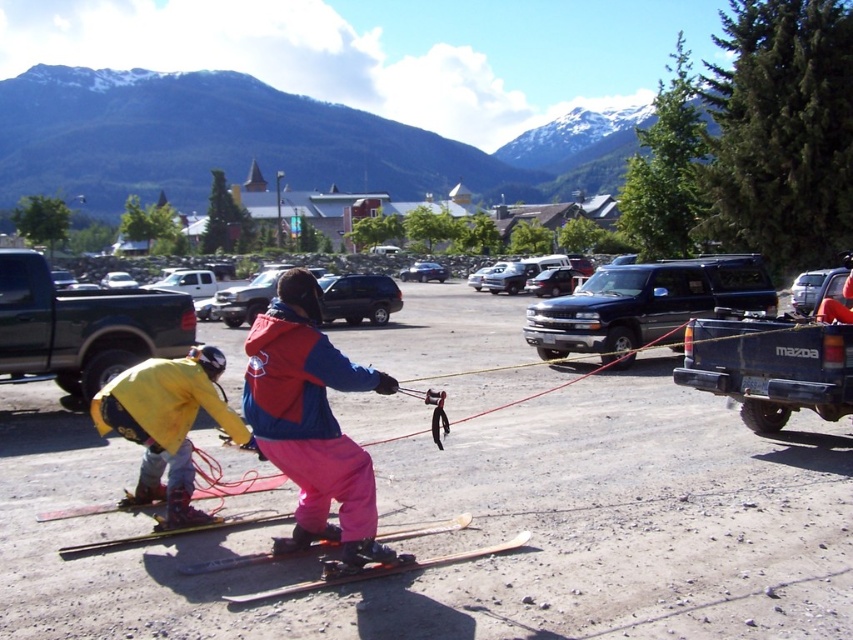
In the scene shown: Does matte black skis at center have a greater width compared to shiny black suv at center?

Correct, the width of matte black skis at center exceeds that of shiny black suv at center.

Does matte black skis at center come in front of shiny black suv at center?

That is True.

You are a GUI agent. You are given a task and a screenshot of the screen. Output one action in this format:
    pyautogui.click(x=<x>, y=<y>)
    Task: Click on the matte black skis at center
    
    Given the screenshot: What is the action you would take?
    pyautogui.click(x=473, y=525)

Between point (334, 486) and point (645, 266), which one is positioned in front?

Point (334, 486)

Does matte blue and red ski jacket at center appear under black matte suv at center?

Indeed, matte blue and red ski jacket at center is positioned under black matte suv at center.

You are a GUI agent. You are given a task and a screenshot of the screen. Output one action in this format:
    pyautogui.click(x=<x>, y=<y>)
    Task: Click on the matte blue and red ski jacket at center
    Image resolution: width=853 pixels, height=640 pixels.
    Given the screenshot: What is the action you would take?
    pyautogui.click(x=311, y=420)

Who is higher up, yellow matte jacket at lower left or orange plastic ski at center?

yellow matte jacket at lower left is above.

Is the position of yellow matte jacket at lower left more distant than that of orange plastic ski at center?

That is True.

Does point (171, 460) lie in front of point (401, 568)?

No.

Locate an element on the screen. The width and height of the screenshot is (853, 640). yellow matte jacket at lower left is located at coordinates (167, 424).